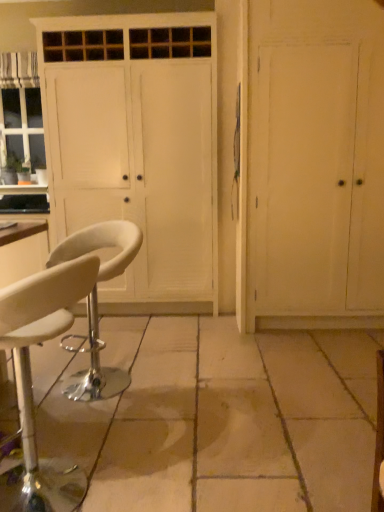
Identify the location of free location to the right of white leather stool at lower left, the second chair from the back. (170, 467).